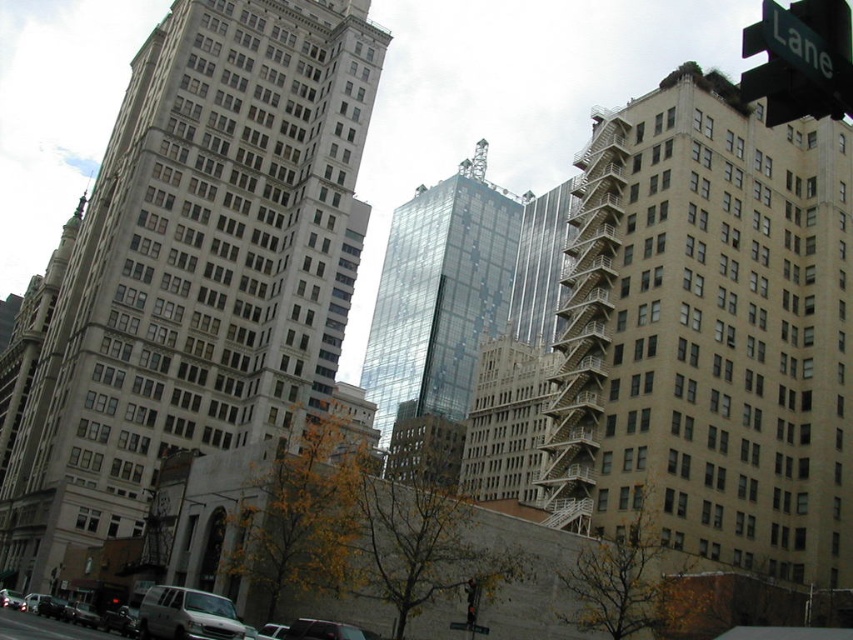
How much distance is there between silver metallic van at lower left and green plastic street sign at upper right?

silver metallic van at lower left is 80.31 feet from green plastic street sign at upper right.

Is silver metallic van at lower left bigger than green plastic street sign at upper right?

Actually, silver metallic van at lower left might be smaller than green plastic street sign at upper right.

Where is `silver metallic van at lower left`? Image resolution: width=853 pixels, height=640 pixels. silver metallic van at lower left is located at coordinates (10, 600).

Is matte white van at lower left bigger than metallic traffic light at center?

Yes, matte white van at lower left is bigger than metallic traffic light at center.

This screenshot has height=640, width=853. Identify the location of matte white van at lower left. (44, 627).

Is transparent glass building at center smaller than matte white van at lower left?

No, transparent glass building at center is not smaller than matte white van at lower left.

Which is in front, point (404, 227) or point (73, 634)?

Point (73, 634)

The width and height of the screenshot is (853, 640). In order to click on transparent glass building at center in this screenshot , I will do `click(440, 296)`.